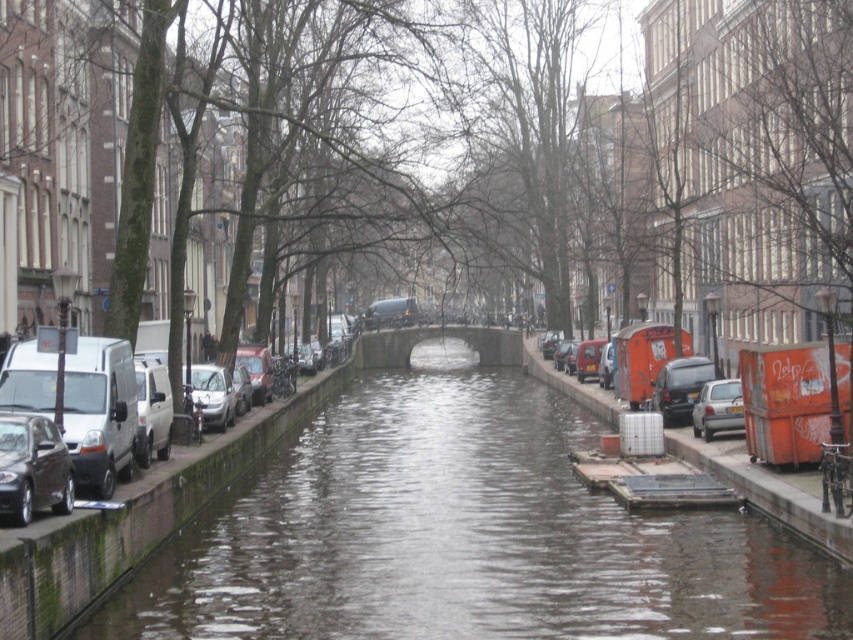
Question: Does matte black van at center come in front of silver metallic car at center-left?

Choices:
 (A) no
 (B) yes

Answer: (A)

Question: Is shiny black car at left above silver metallic car at center-left?

Choices:
 (A) yes
 (B) no

Answer: (A)

Question: Based on their relative distances, which object is nearer to the shiny black car at left?

Choices:
 (A) smooth concrete canal at center
 (B) silver metallic car at center-left
 (C) matte black van at center

Answer: (A)

Question: Which object is closer to the camera taking this photo?

Choices:
 (A) silver metallic car at center
 (B) shiny black car at left
 (C) smooth concrete canal at center

Answer: (B)

Question: Based on their relative distances, which object is nearer to the smooth concrete canal at center?

Choices:
 (A) matte black van at center
 (B) silver metallic car at center-left
 (C) silver metallic car at center

Answer: (C)

Question: Does matte black van at center appear on the left side of silver metallic car at center-left?

Choices:
 (A) no
 (B) yes

Answer: (A)